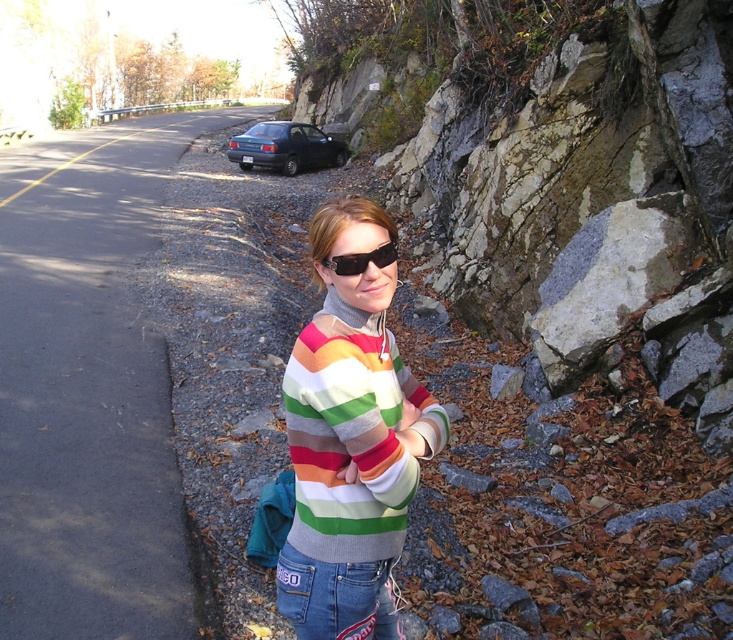
Question: From the image, what is the correct spatial relationship of gravel at left in relation to black plastic sunglasses at center?

Choices:
 (A) right
 (B) left

Answer: (B)

Question: Is gravel at left to the left of gray/granite rock at right from the viewer's perspective?

Choices:
 (A) no
 (B) yes

Answer: (B)

Question: Which is nearer to the gray/granite rock at right?

Choices:
 (A) rainbow striped sweater at center
 (B) gravel at left

Answer: (A)

Question: Which object appears farthest from the camera in this image?

Choices:
 (A) black plastic sunglasses at center
 (B) rainbow striped sweater at center
 (C) gravel at left

Answer: (C)

Question: Which of the following is the closest to the observer?

Choices:
 (A) (125, 372)
 (B) (336, 262)
 (C) (405, 508)
 (D) (550, 321)

Answer: (B)

Question: Is the position of gravel at left more distant than that of black plastic sunglasses at center?

Choices:
 (A) no
 (B) yes

Answer: (B)